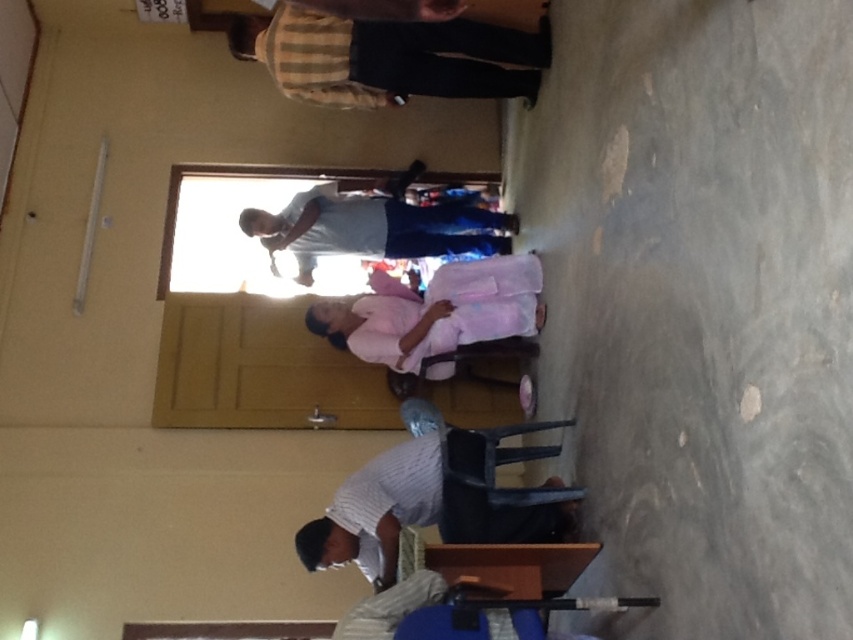
I want to click on striped cotton shirt at upper center, so click(x=390, y=58).

Does striped cotton shirt at upper center have a greater height compared to matte gray shirt at center?

No.

Which is behind, point (370, 102) or point (393, 214)?

The point (393, 214) is more distant.

Image resolution: width=853 pixels, height=640 pixels. Identify the location of striped cotton shirt at upper center. (390, 58).

Which of these two, striped cotton shirt at upper center or pink fabric at center, stands taller?

pink fabric at center is taller.

Is striped cotton shirt at upper center bigger than pink fabric at center?

Yes, striped cotton shirt at upper center is bigger than pink fabric at center.

Image resolution: width=853 pixels, height=640 pixels. Describe the element at coordinates (390, 58) in the screenshot. I see `striped cotton shirt at upper center` at that location.

Where is `striped cotton shirt at upper center`? This screenshot has height=640, width=853. striped cotton shirt at upper center is located at coordinates (390, 58).

Is point (438, 449) farther from viewer compared to point (474, 637)?

Yes, it is behind point (474, 637).

Which is above, striped fabric shirt at lower center or blue fabric stool at lower center?

striped fabric shirt at lower center is higher up.

Identify the location of striped fabric shirt at lower center. This screenshot has width=853, height=640. (376, 509).

This screenshot has width=853, height=640. Find the location of `striped fabric shirt at lower center`. striped fabric shirt at lower center is located at coordinates (376, 509).